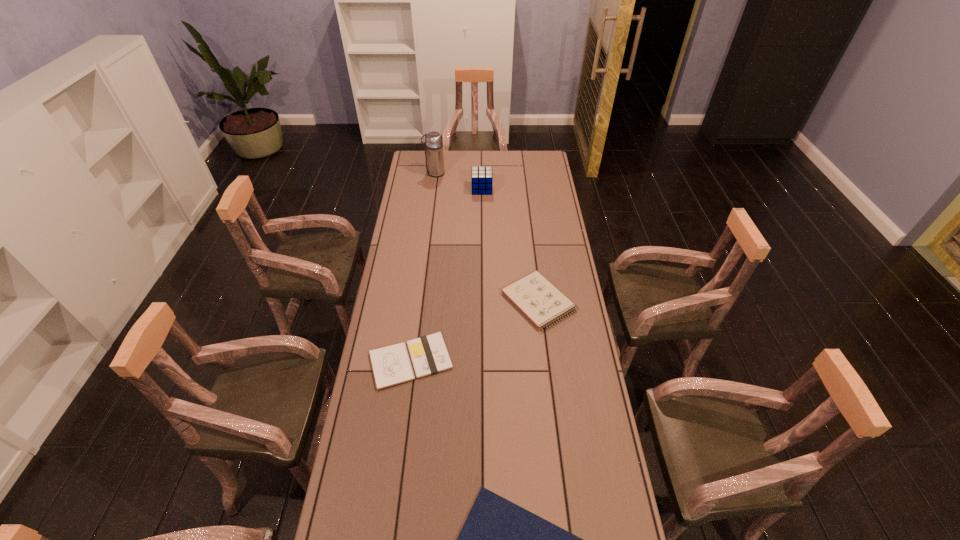
Where is `thermos bottle`? The width and height of the screenshot is (960, 540). thermos bottle is located at coordinates (433, 143).

Locate an element on the screen. Image resolution: width=960 pixels, height=540 pixels. the farthest object is located at coordinates (433, 143).

Identify the location of the fourth nearest object. (481, 178).

The width and height of the screenshot is (960, 540). What are the coordinates of `the second tallest object` in the screenshot? It's located at (481, 178).

Locate an element on the screen. The height and width of the screenshot is (540, 960). the third shortest object is located at coordinates (539, 300).

Locate an element on the screen. The height and width of the screenshot is (540, 960). vacant region located with a handle on the side of the tallest object is located at coordinates (410, 173).

Where is `free space located on the front of the second farthest object`? This screenshot has height=540, width=960. free space located on the front of the second farthest object is located at coordinates (482, 201).

Identify the location of vacant area situated 0.210m on the front of the tallest notepad. (548, 381).

Find the location of a particular element. object present at the far edge is located at coordinates (433, 143).

You are a GUI agent. You are given a task and a screenshot of the screen. Output one action in this format:
    pyautogui.click(x=<x>, y=<y>)
    Task: Click on the thermos bottle that is at the left edge
    The image size is (960, 540).
    Given the screenshot: What is the action you would take?
    pyautogui.click(x=433, y=143)